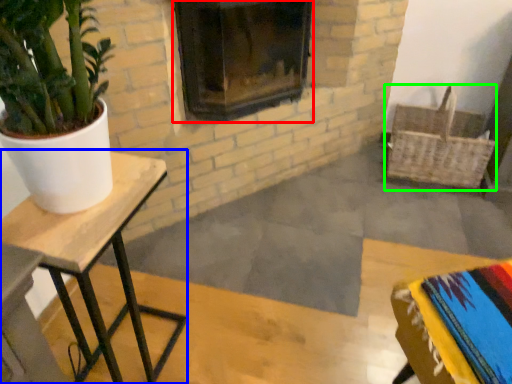
Question: Based on their relative distances, which object is farther from fireplace (highlighted by a red box)? Choose from table (highlighted by a blue box) and basket (highlighted by a green box).

Choices:
 (A) table
 (B) basket

Answer: (A)